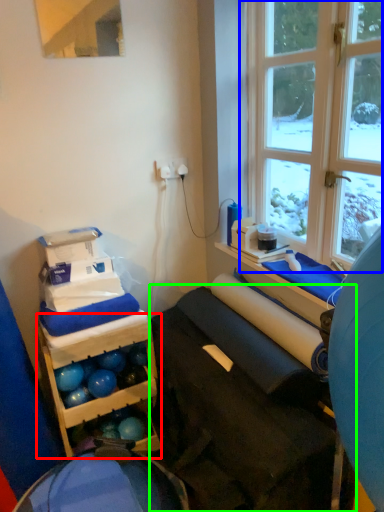
Question: Based on their relative distances, which object is farther from shelf (highlighted by a red box)? Choose from window (highlighted by a blue box) and furniture (highlighted by a green box).

Choices:
 (A) window
 (B) furniture

Answer: (A)